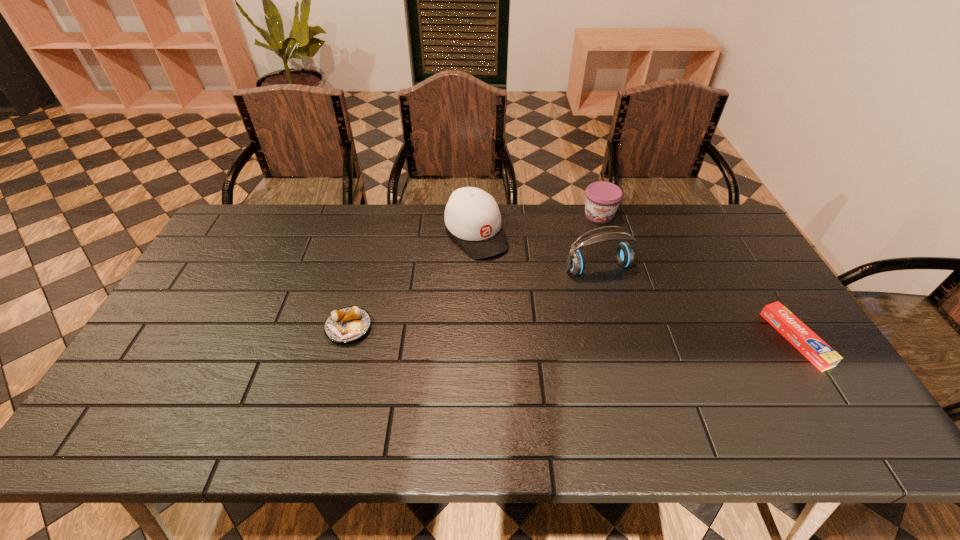
This screenshot has width=960, height=540. Find the location of `free space located on the ear cups of the headset`. free space located on the ear cups of the headset is located at coordinates (629, 315).

You are a GUI agent. You are given a task and a screenshot of the screen. Output one action in this format:
    pyautogui.click(x=<x>, y=<y>)
    Task: Click on the free region located on the ear cups of the headset
    The image size is (960, 540).
    Given the screenshot: What is the action you would take?
    pyautogui.click(x=642, y=337)

The height and width of the screenshot is (540, 960). I want to click on vacant space located on the front label of the jam, so click(602, 272).

Image resolution: width=960 pixels, height=540 pixels. In order to click on vacant space situated 0.100m on the front label of the jam in this screenshot , I will do `click(601, 245)`.

Locate an element on the screen. Image resolution: width=960 pixels, height=540 pixels. vacant region located on the front label of the jam is located at coordinates (602, 264).

At what (x,y) coordinates should I click in order to perform the action: click on vacant space located 0.240m on the front-facing side of the baseball cap. Please return your answer as a coordinate pair (x, y). The width and height of the screenshot is (960, 540). Looking at the image, I should click on (529, 309).

The width and height of the screenshot is (960, 540). Find the location of `blank space located 0.210m on the front-facing side of the baseball cap`. blank space located 0.210m on the front-facing side of the baseball cap is located at coordinates (523, 302).

Locate an element on the screen. This screenshot has height=540, width=960. free region located on the front-facing side of the baseball cap is located at coordinates (525, 305).

Identify the location of jam that is at the far edge. (602, 199).

At what (x,y) coordinates should I click in order to perform the action: click on baseball cap that is at the far edge. Please return your answer as a coordinate pair (x, y). Image resolution: width=960 pixels, height=540 pixels. Looking at the image, I should click on (472, 215).